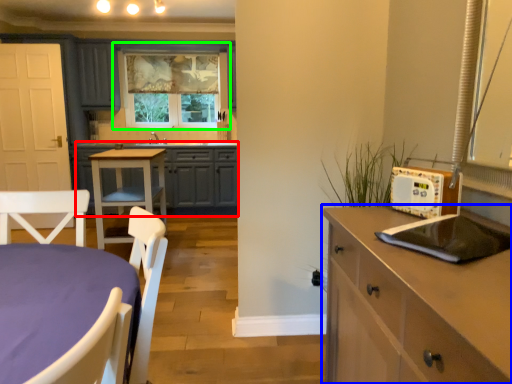
Question: Considering the real-world distances, which object is farthest from cabinetry (highlighted by a red box)? cabinetry (highlighted by a blue box) or window (highlighted by a green box)?

Choices:
 (A) cabinetry
 (B) window

Answer: (A)